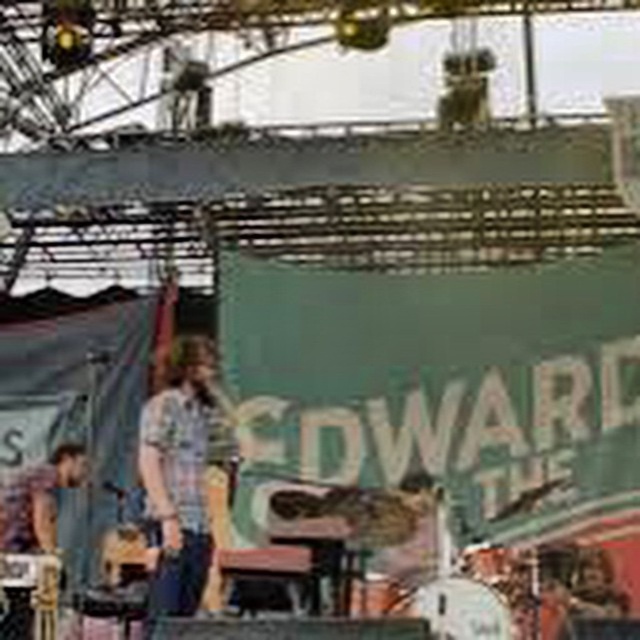
You are a photographer at the music event and want to capture a clear photo of the matte gray shirt at lower left. However, the plaid shirt at center is blocking the view. Can you move to the right side to get a better shot?

The matte gray shirt at lower left is behind the plaid shirt at center, so moving to the right side might not help since the plaid shirt is still in front. You might need to move around to a different angle where the plaid shirt at center is no longer blocking the view.

You are standing at the center of the stage. There are two points marked on the stage floor. The first point is at position point [225,480] and the second is at point [33,536]. Which point is closer to you?

Point [33,536] is closer to you because it is in front of point [225,480].